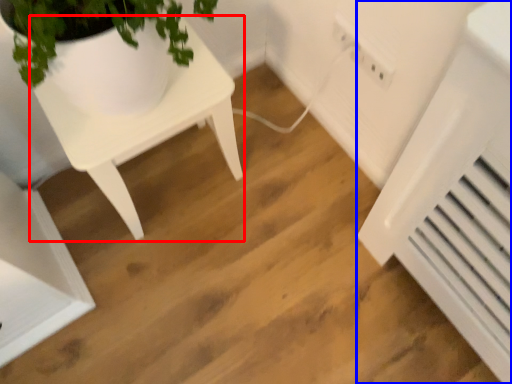
Question: Among these objects, which one is nearest to the camera, table (highlighted by a red box) or air conditioning (highlighted by a blue box)?

Choices:
 (A) table
 (B) air conditioning

Answer: (A)